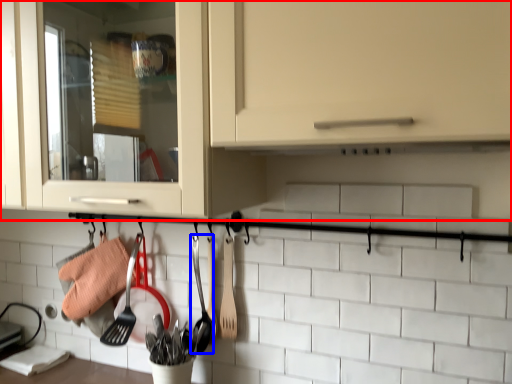
Question: Which object appears farthest to the camera in this image, cabinetry (highlighted by a red box) or silverware (highlighted by a blue box)?

Choices:
 (A) cabinetry
 (B) silverware

Answer: (B)